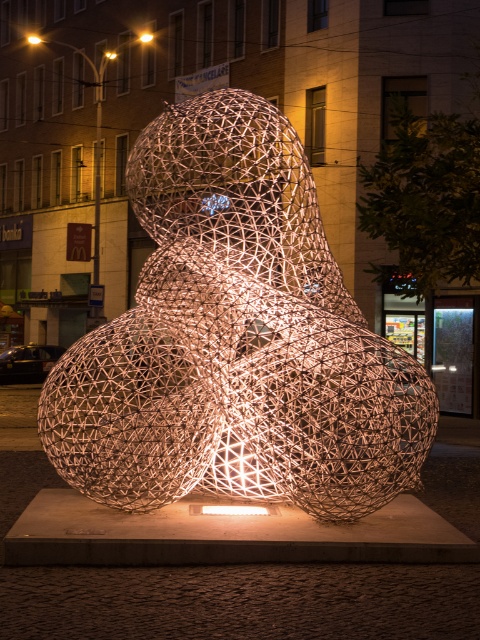
Question: Which object appears farthest from the camera in this image?

Choices:
 (A) iridescent wire mesh sculpture at center
 (B) matte gold light at center
 (C) bright yellow light at center
 (D) yellow glass streetlight at upper center

Answer: (D)

Question: Which point appears closest to the camera in this image?

Choices:
 (A) (104, 54)
 (B) (145, 33)

Answer: (B)

Question: Based on their relative distances, which object is nearer to the bright yellow light at center?

Choices:
 (A) yellow glass streetlight at upper center
 (B) matte gold light at center
 (C) iridescent wire mesh sculpture at center

Answer: (A)

Question: Observing the image, what is the correct spatial positioning of bright yellow light at center in reference to matte gold light at center?

Choices:
 (A) below
 (B) above

Answer: (B)

Question: Is iridescent wire mesh sculpture at center smaller than yellow glass streetlight at upper center?

Choices:
 (A) yes
 (B) no

Answer: (B)

Question: Can you confirm if bright yellow light at center is positioned above yellow glass streetlight at upper center?

Choices:
 (A) yes
 (B) no

Answer: (A)